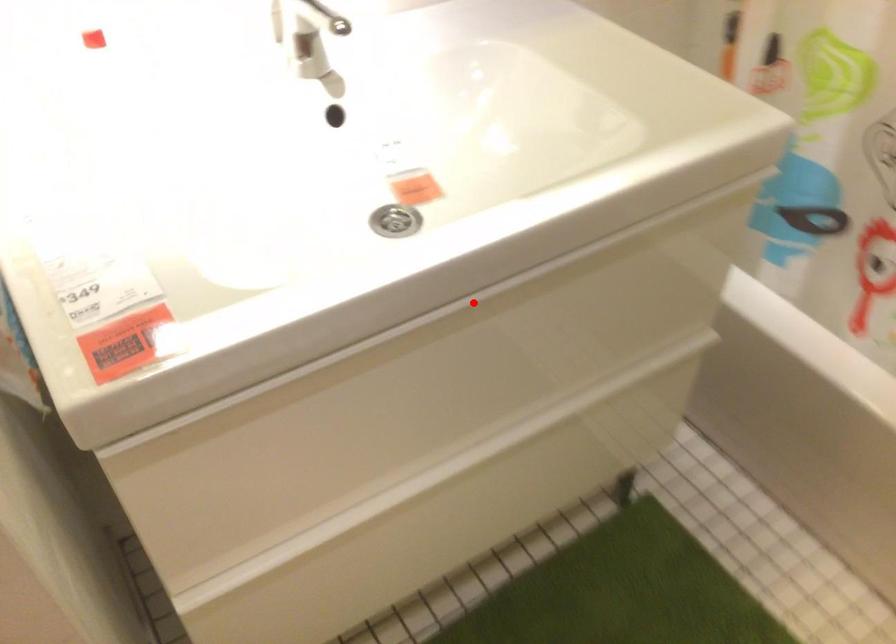
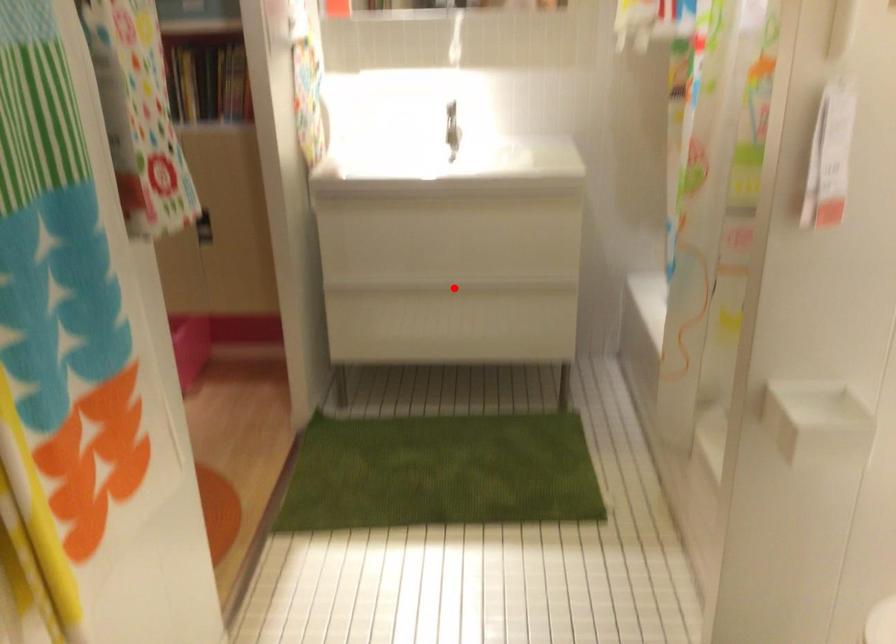
I am providing you with two images of the same scene from different viewpoints. A red point is marked on the first image and another point is marked on the second image. Is the marked point in image1 the same physical position as the marked point in image2?

No